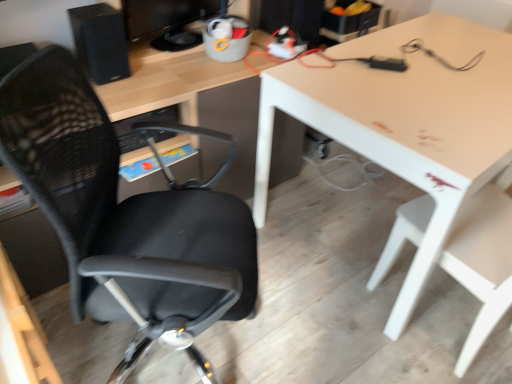
Find the location of a particular element. This screenshot has height=384, width=512. vacant space in white plastic chair at lower right, the second chair positioned from the left (from a real-world perspective) is located at coordinates (459, 327).